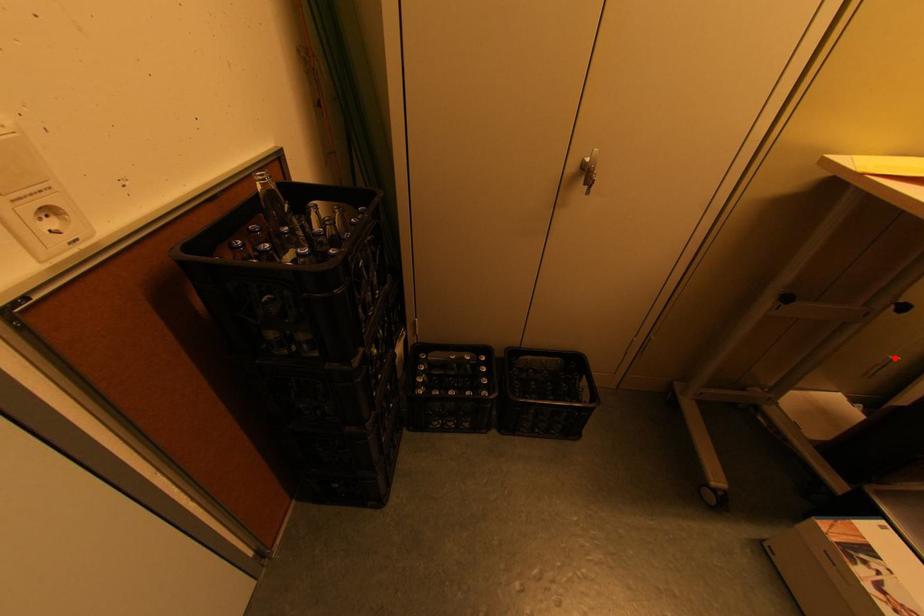
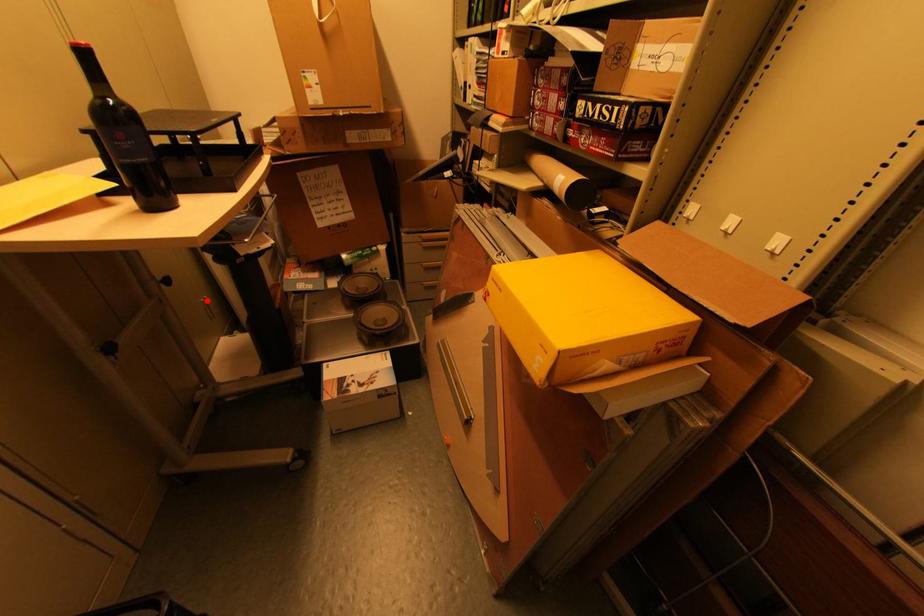
I am providing you with two images of the same scene from different viewpoints. A red point is marked on the first image and another point is marked on the second image. Does the point marked in image1 correspond to the same location as the one in image2?

Yes